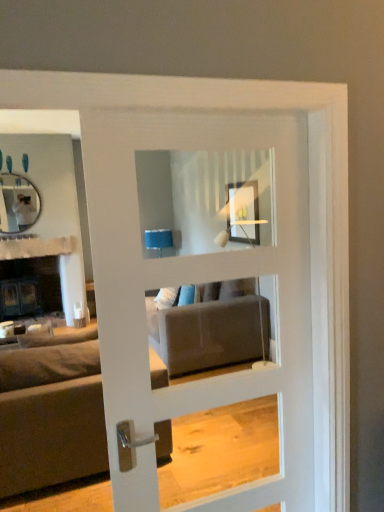
Question: Is dark gray fabric couch at left inside the boundaries of white glossy door at center, or outside?

Choices:
 (A) outside
 (B) inside

Answer: (A)

Question: Is point (59, 437) positioned closer to the camera than point (162, 258)?

Choices:
 (A) closer
 (B) farther

Answer: (B)

Question: Which is farther from the matte black mirror at upper left?

Choices:
 (A) white textured fabric at upper left
 (B) dark gray fabric couch at left
 (C) white glossy door at center

Answer: (C)

Question: Which of these objects is positioned closest to the matte black mirror at upper left?

Choices:
 (A) dark gray fabric couch at left
 (B) white glossy door at center
 (C) white textured fabric at upper left

Answer: (C)